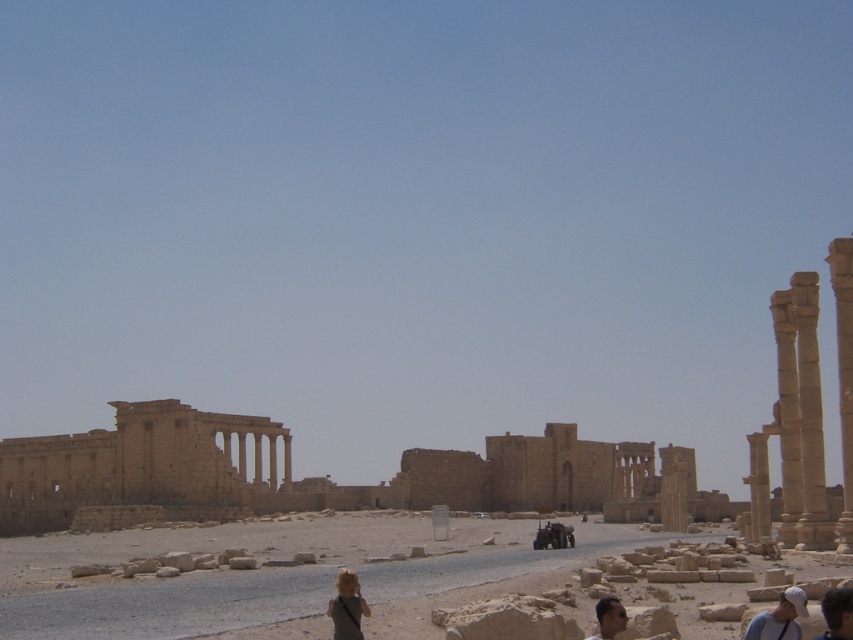
You are standing at the ruins and want to take a photo of both point (827, 630) and point (606, 621). Which point should you position closer to the camera to ensure both are in the frame?

Point (827, 630) is behind point (606, 621), so you should position closer to point (827, 630) to ensure both are visible in the frame.

You are standing at the ruins and notice a light brown leather cap at lower right and a dark brown hair at lower right. Which object is nearer to you?

The light brown leather cap at lower right is closer to the viewer than dark brown hair at lower right.

You are a tourist visiting the ancient ruins and you dropped your light brown leather cap at lower right. Where should you look for it?

The light brown leather cap at lower right is located at point 0.914 on the x axis and 0.966 on the y axis.